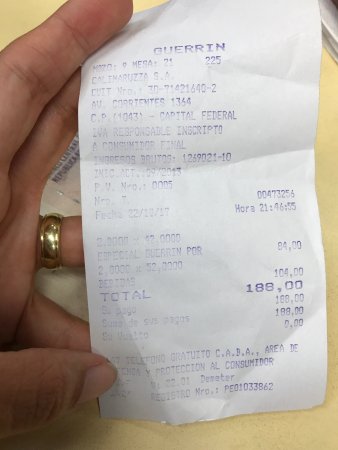
The height and width of the screenshot is (450, 338). Identify the location of table number. (166, 61).